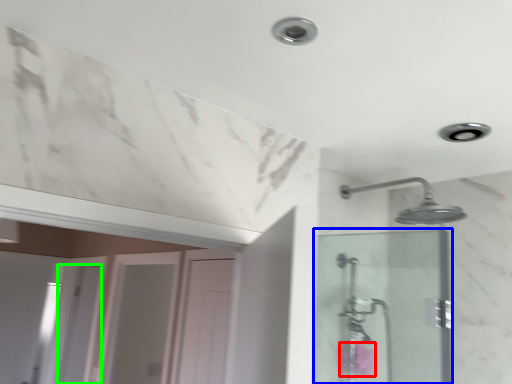
Question: Estimate the real-world distances between objects in this image. Which object is closer to flower (highlighted by a red box), screen door (highlighted by a blue box) or screen door (highlighted by a green box)?

Choices:
 (A) screen door
 (B) screen door

Answer: (A)